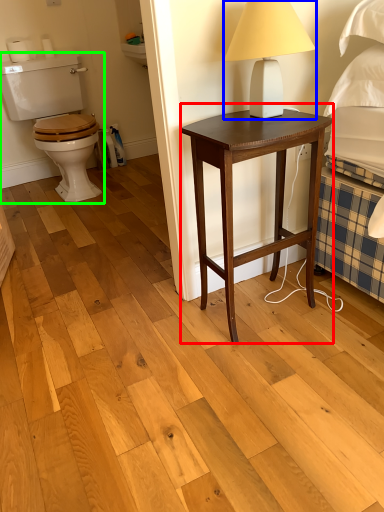
Question: Which object is positioned closest to nightstand (highlighted by a red box)? Select from table lamp (highlighted by a blue box) and sit (highlighted by a green box).

Choices:
 (A) table lamp
 (B) sit

Answer: (A)